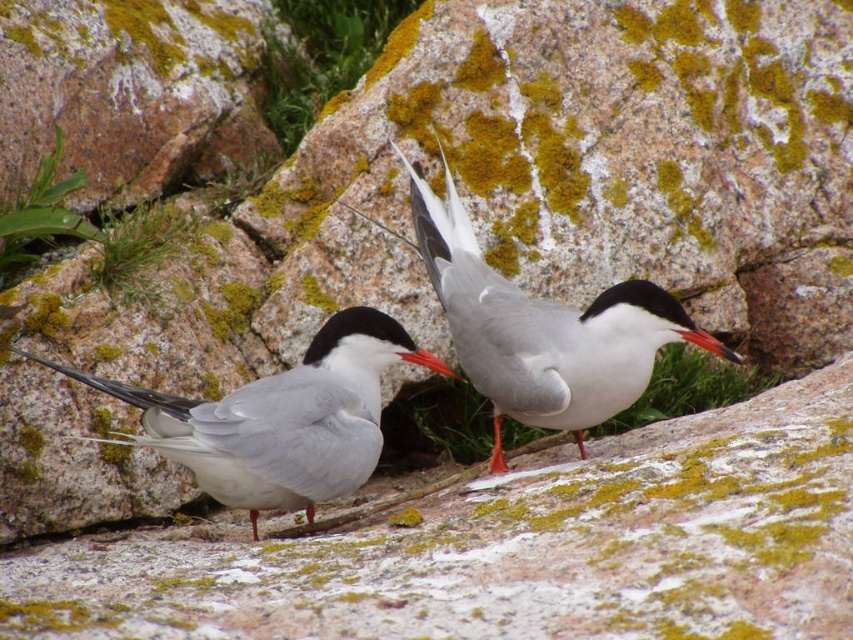
Who is more distant from viewer, (503, 465) or (720, 352)?

The point (503, 465) is behind.

Which of these two, white glossy bird at center or smooth glossy beak at center, stands shorter?

With less height is smooth glossy beak at center.

In order to click on white glossy bird at center in this screenshot , I will do `click(537, 330)`.

Is smooth glossy beak at center positioned in front of orange glossy beak at center?

No, it is behind orange glossy beak at center.

Locate an element on the screen. smooth glossy beak at center is located at coordinates (708, 342).

Does point (701, 332) come behind point (433, 369)?

Yes.

Find the location of `smooth glossy beak at center`. smooth glossy beak at center is located at coordinates (708, 342).

Is white glossy bird at center wider than orange glossy beak at center?

Indeed, white glossy bird at center has a greater width compared to orange glossy beak at center.

Is point (599, 376) more distant than point (453, 376)?

That is True.

At what (x,y) coordinates should I click in order to perform the action: click on white glossy bird at center. Please return your answer as a coordinate pair (x, y). The width and height of the screenshot is (853, 640). Looking at the image, I should click on (537, 330).